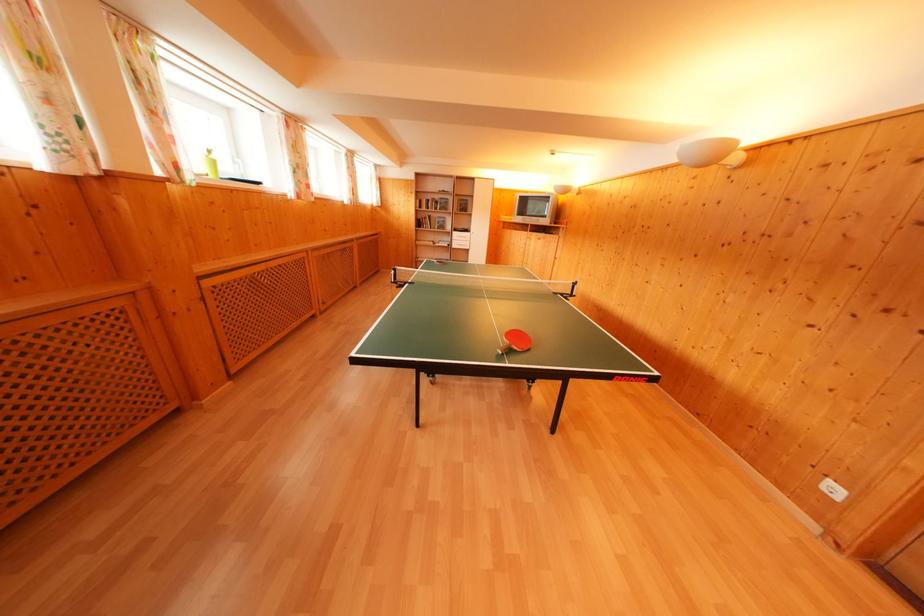
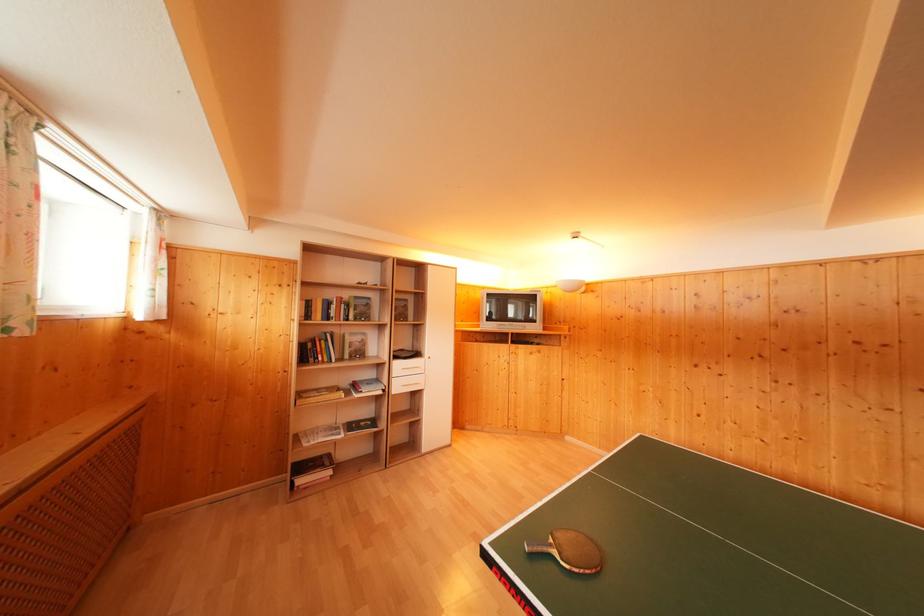
In the second image, find the point that corresponds to pixel 451 262 in the first image.

(371, 416)